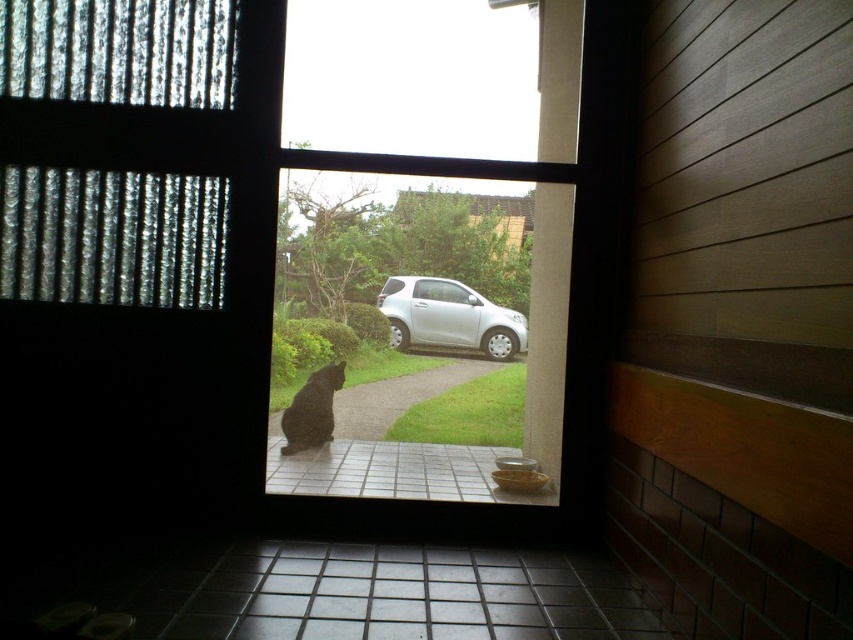
At what (x,y) coordinates should I click in order to perform the action: click on silver metallic car at center. Please return your answer as a coordinate pair (x, y). The image size is (853, 640). Looking at the image, I should click on pyautogui.click(x=450, y=316).

What do you see at coordinates (450, 316) in the screenshot? The image size is (853, 640). I see `silver metallic car at center` at bounding box center [450, 316].

Locate an element on the screen. The image size is (853, 640). silver metallic car at center is located at coordinates (450, 316).

Who is positioned more to the right, transparent glass window at center or silver metallic car at center?

silver metallic car at center is more to the right.

From the picture: Is the position of transparent glass window at center more distant than that of silver metallic car at center?

No, transparent glass window at center is in front of silver metallic car at center.

Is point (281, 228) behind point (514, 336)?

That is True.

Locate an element on the screen. This screenshot has width=853, height=640. transparent glass window at center is located at coordinates (428, 228).

Between point (334, 28) and point (334, 369), which one is positioned behind?

The point (334, 369) is more distant.

Consider the image. Who is higher up, transparent glass window at center or black fur cat at center?

transparent glass window at center is above.

At what (x,y) coordinates should I click in order to perform the action: click on transparent glass window at center. Please return your answer as a coordinate pair (x, y). This screenshot has width=853, height=640. Looking at the image, I should click on (428, 228).